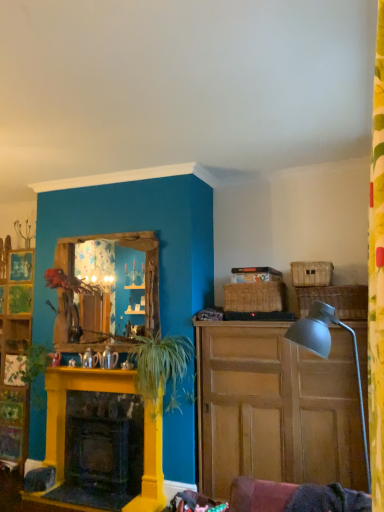
Locate an element on the screen. The height and width of the screenshot is (512, 384). free point below yellow painted wood fireplace at lower left (from a real-world perspective) is located at coordinates (104, 492).